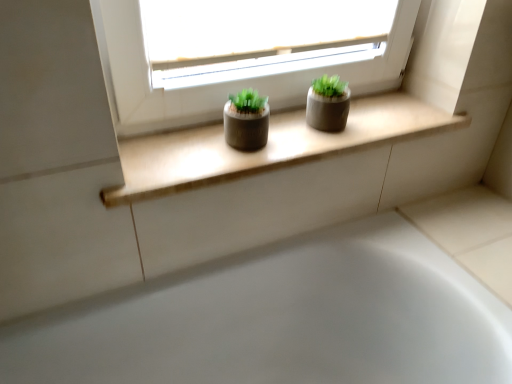
At what (x,y) coordinates should I click in order to perform the action: click on white glossy bathtub at lower center. Please return your answer as a coordinate pair (x, y). This screenshot has height=384, width=512. Looking at the image, I should click on (283, 320).

The height and width of the screenshot is (384, 512). What do you see at coordinates (283, 320) in the screenshot?
I see `white glossy bathtub at lower center` at bounding box center [283, 320].

Image resolution: width=512 pixels, height=384 pixels. Describe the element at coordinates (267, 147) in the screenshot. I see `matte concrete window sill at center` at that location.

Locate an element on the screen. Image resolution: width=512 pixels, height=384 pixels. matte concrete window sill at center is located at coordinates (267, 147).

Where is `white glossy bathtub at lower center`? This screenshot has width=512, height=384. white glossy bathtub at lower center is located at coordinates (283, 320).

Can you confirm if matte concrete window sill at center is positioned to the left of white glossy bathtub at lower center?

No, matte concrete window sill at center is not to the left of white glossy bathtub at lower center.

Considering the positions of objects matte concrete window sill at center and white glossy bathtub at lower center in the image provided, who is behind, matte concrete window sill at center or white glossy bathtub at lower center?

matte concrete window sill at center is further away from the camera.

Does point (152, 149) appear closer or farther from the camera than point (367, 353)?

Point (152, 149) appears to be closer to the viewer than point (367, 353).

From the image's perspective, would you say matte concrete window sill at center is positioned over white glossy bathtub at lower center?

Correct, matte concrete window sill at center appears higher than white glossy bathtub at lower center in the image.

From a real-world perspective, is matte concrete window sill at center physically located above or below white glossy bathtub at lower center?

Clearly, from a real-world perspective, matte concrete window sill at center is above white glossy bathtub at lower center.

Considering the relative sizes of matte concrete window sill at center and white glossy bathtub at lower center in the image provided, is matte concrete window sill at center thinner than white glossy bathtub at lower center?

Yes, matte concrete window sill at center is thinner than white glossy bathtub at lower center.

Considering the relative sizes of matte concrete window sill at center and white glossy bathtub at lower center in the image provided, is matte concrete window sill at center taller than white glossy bathtub at lower center?

No.

Considering the relative sizes of matte concrete window sill at center and white glossy bathtub at lower center in the image provided, is matte concrete window sill at center bigger than white glossy bathtub at lower center?

Incorrect, matte concrete window sill at center is not larger than white glossy bathtub at lower center.

Would you say matte concrete window sill at center is outside white glossy bathtub at lower center?

Absolutely, matte concrete window sill at center is external to white glossy bathtub at lower center.

Is matte concrete window sill at center next to white glossy bathtub at lower center?

They are not placed beside each other.

Consider the image. Could you tell me if matte concrete window sill at center is turned towards white glossy bathtub at lower center?

No, matte concrete window sill at center is not oriented towards white glossy bathtub at lower center.

How different are the orientations of matte concrete window sill at center and white glossy bathtub at lower center in degrees?

The facing directions of matte concrete window sill at center and white glossy bathtub at lower center are 0.0773 degrees apart.

Identify the location of window sill behind the white glossy bathtub at lower center. (267, 147).

Does white glossy bathtub at lower center appear on the right side of matte concrete window sill at center?

No.

Is white glossy bathtub at lower center in front of matte concrete window sill at center?

Yes.

Considering the positions of points (261, 294) and (193, 141), is point (261, 294) closer to camera compared to point (193, 141)?

No, (261, 294) is behind (193, 141).

From the image's perspective, is white glossy bathtub at lower center above or below matte concrete window sill at center?

white glossy bathtub at lower center is situated lower than matte concrete window sill at center in the image.

From a real-world perspective, is white glossy bathtub at lower center beneath matte concrete window sill at center?

Yes, from a real-world perspective, white glossy bathtub at lower center is under matte concrete window sill at center.

Considering the sizes of white glossy bathtub at lower center and matte concrete window sill at center in the image, is white glossy bathtub at lower center wider or thinner than matte concrete window sill at center?

Clearly, white glossy bathtub at lower center has more width compared to matte concrete window sill at center.

Is white glossy bathtub at lower center taller or shorter than matte concrete window sill at center?

In the image, white glossy bathtub at lower center appears to be taller than matte concrete window sill at center.

Based on their sizes in the image, would you say white glossy bathtub at lower center is bigger or smaller than matte concrete window sill at center?

Clearly, white glossy bathtub at lower center is larger in size than matte concrete window sill at center.

Which is correct: white glossy bathtub at lower center is inside matte concrete window sill at center, or outside of it?

white glossy bathtub at lower center exists outside the volume of matte concrete window sill at center.

Would you say white glossy bathtub at lower center is a long distance from matte concrete window sill at center?

No, white glossy bathtub at lower center is not far away from matte concrete window sill at center.

Could you tell me if white glossy bathtub at lower center is turned towards matte concrete window sill at center?

No, white glossy bathtub at lower center is not facing towards matte concrete window sill at center.

From the picture: How different are the orientations of white glossy bathtub at lower center and matte concrete window sill at center in degrees?

0.0773 degrees.

Measure the distance between white glossy bathtub at lower center and matte concrete window sill at center.

36.31 centimeters.

I want to click on window sill that is behind the white glossy bathtub at lower center, so click(267, 147).

What are the coordinates of `bathtub that is on the left side of matte concrete window sill at center` in the screenshot? It's located at (283, 320).

What are the coordinates of `window sill above the white glossy bathtub at lower center (from a real-world perspective)` in the screenshot? It's located at (267, 147).